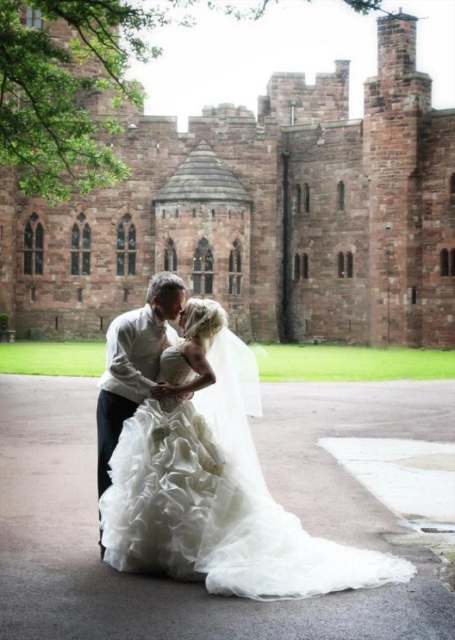
You are a photographer at the castle and need to capture a photo of the white tulle dress at center and the matte white shirt at center. From your current position, which one is closer to the camera?

The white tulle dress at center is in front of the matte white shirt at center, so it is closer to the camera.